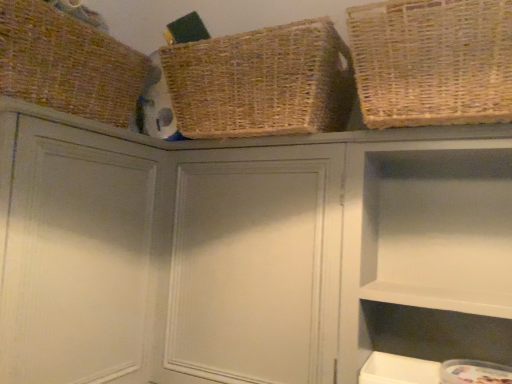
Question: From a real-world perspective, relative to brown woven basket at upper left, which appears as the first basket when viewed from the left, is natural woven basket at upper right, acting as the third basket starting from the left, vertically above or below?

Choices:
 (A) above
 (B) below

Answer: (B)

Question: Relative to brown woven basket at upper left, which appears as the first basket when viewed from the left, is natural woven basket at upper right, acting as the third basket starting from the left, in front or behind?

Choices:
 (A) front
 (B) behind

Answer: (A)

Question: Which object is positioned farthest from the woven natural basket at upper center, arranged as the 2th basket when viewed from the left?

Choices:
 (A) brown woven basket at upper left, positioned as the third basket in right-to-left order
 (B) white matte cabinet at upper right, the first cabinet positioned from the right
 (C) natural woven basket at upper right, acting as the third basket starting from the left
 (D) matte gray cabinet at upper left, which appears as the first cabinet when viewed from the left
 (E) matte gray cabinet at center, the second cabinet in the left-to-right sequence

Answer: (D)

Question: Estimate the real-world distances between objects in this image. Which object is farther from the natural woven basket at upper right, which is the first basket in right-to-left order?

Choices:
 (A) woven natural basket at upper center, the second basket positioned from the right
 (B) brown woven basket at upper left, positioned as the third basket in right-to-left order
 (C) matte gray cabinet at upper left, the 3th cabinet from the right
 (D) matte gray cabinet at center, the second cabinet in the left-to-right sequence
 (E) white matte cabinet at upper right, the first cabinet positioned from the right

Answer: (C)